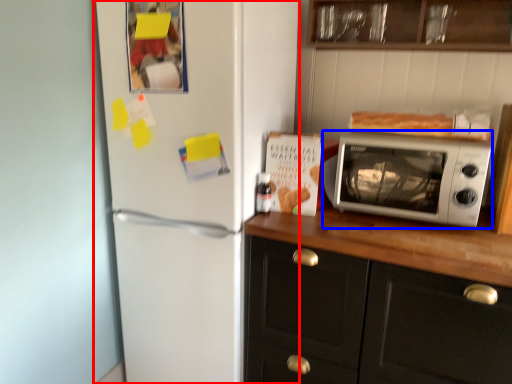
Question: Which object is closer to the camera taking this photo, refrigerator (highlighted by a red box) or microwave oven (highlighted by a blue box)?

Choices:
 (A) refrigerator
 (B) microwave oven

Answer: (A)